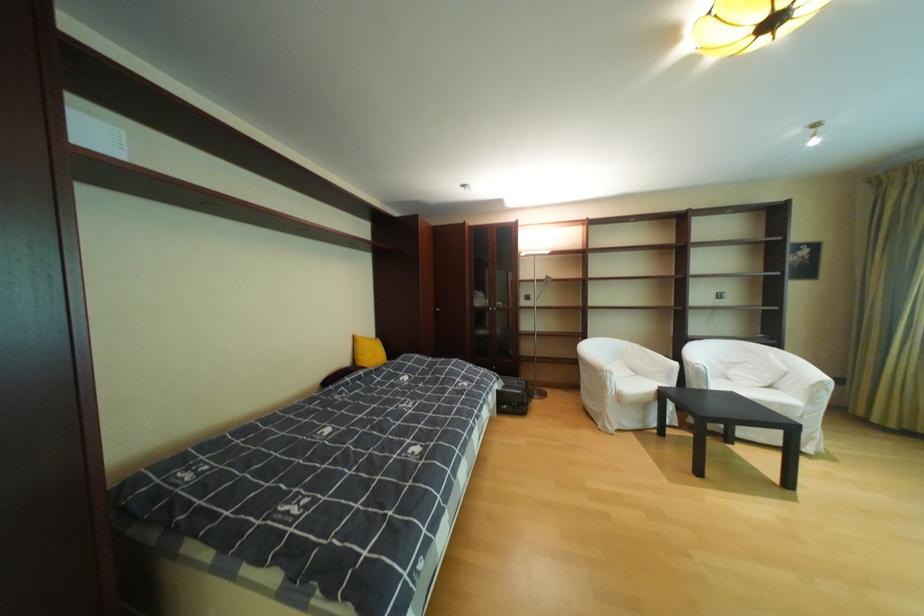
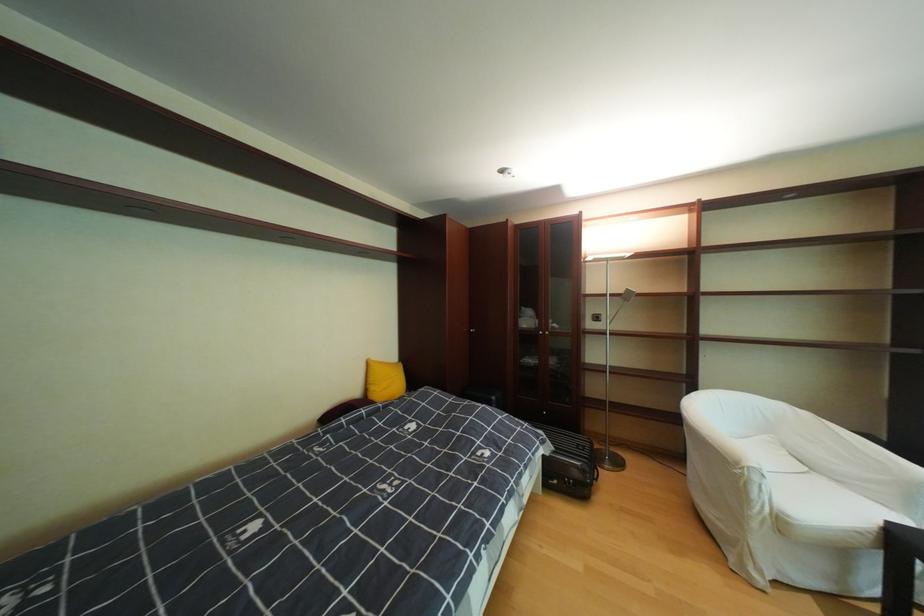
Question: The camera is either moving clockwise (left) or counter-clockwise (right) around the object. The first image is from the beginning of the video and the second image is from the end. Is the camera moving left or right when shooting the video?

Choices:
 (A) Left
 (B) Right

Answer: (B)